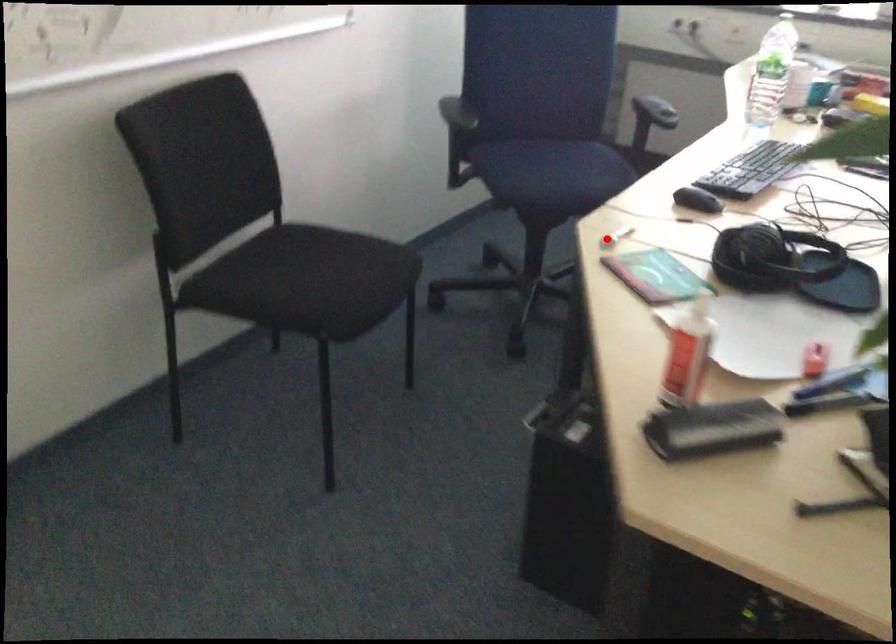
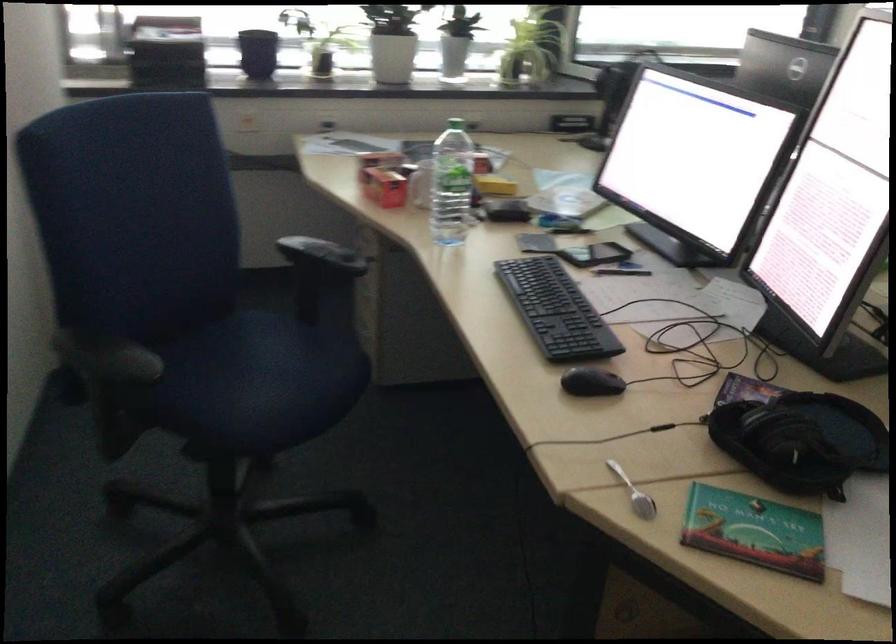
Find the pixel in the second image that matches the highlighted location in the first image.

(633, 494)